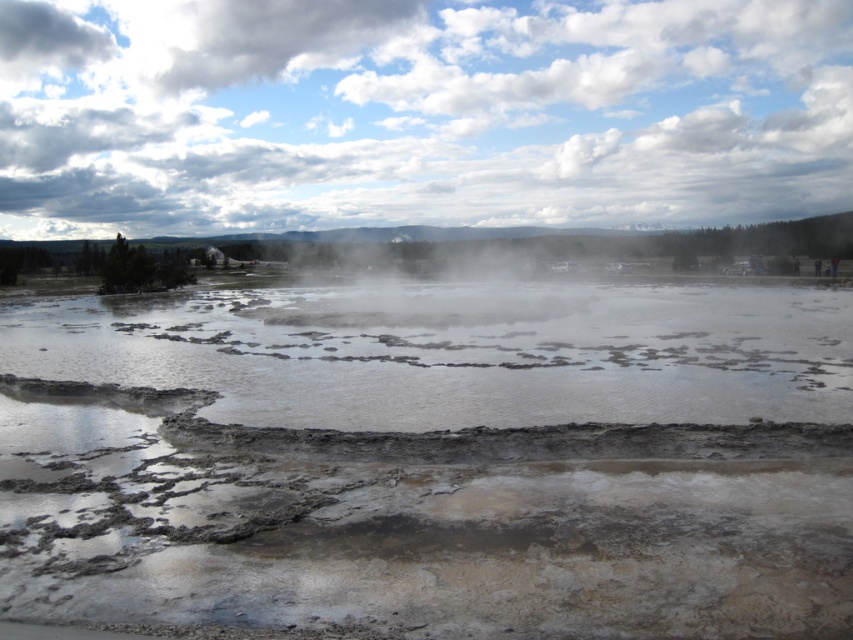
Can you confirm if muddy water at center is positioned below white misty steam at center?

Correct, muddy water at center is located below white misty steam at center.

Is muddy water at center to the left of white misty steam at center from the viewer's perspective?

Correct, you'll find muddy water at center to the left of white misty steam at center.

Where is `muddy water at center`? This screenshot has height=640, width=853. muddy water at center is located at coordinates (433, 460).

I want to click on muddy water at center, so click(x=433, y=460).

Which is behind, point (833, 634) or point (370, 163)?

Positioned behind is point (370, 163).

Between point (544, 438) and point (589, 218), which one is positioned in front?

Positioned in front is point (544, 438).

You are a GUI agent. You are given a task and a screenshot of the screen. Output one action in this format:
    pyautogui.click(x=<x>, y=<y>)
    Task: Click on the muddy water at center
    This screenshot has width=853, height=640.
    Given the screenshot: What is the action you would take?
    pyautogui.click(x=433, y=460)

Does cloudy sky at upper center have a greater width compared to white misty steam at center?

Correct, the width of cloudy sky at upper center exceeds that of white misty steam at center.

Does point (91, 45) come behind point (450, 266)?

Yes.

Is point (686, 209) positioned behind point (398, 316)?

Yes, it is.

Find the location of a particular element. cloudy sky at upper center is located at coordinates [418, 113].